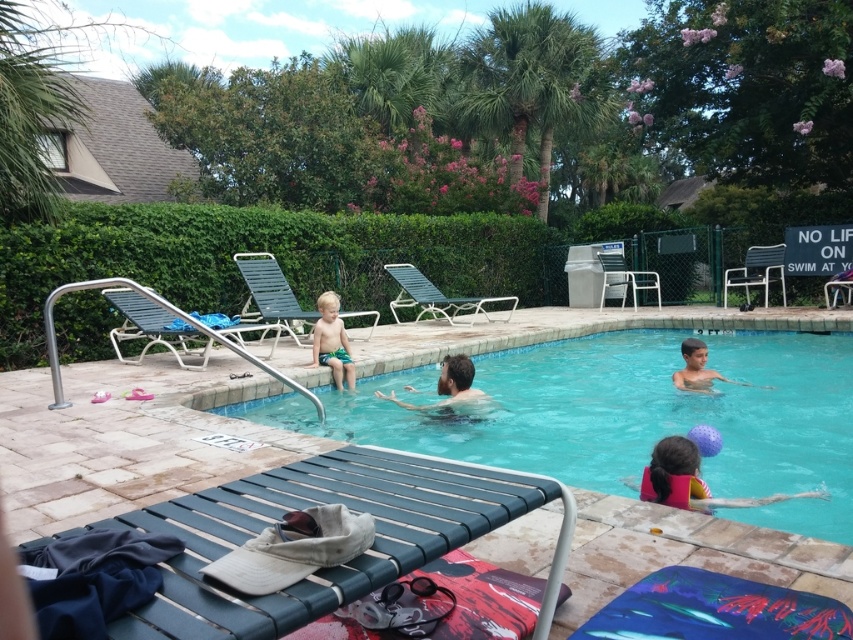
You are standing at the center of the pool deck and want to place a new lounge chair exactly at the point marked as point (689, 481). What object will this new lounge chair be placed near?

The new lounge chair will be placed near the pink life vest at lower right because point (689, 481) corresponds to that object.

You are planning to pack for a day at the pool. You have a backpack that can only fit one item. The pink life vest at lower right and the green fabric shorts at center are both in your sight. Which item should you take if you need to carry the larger one?

The pink life vest at lower right is bigger than the green fabric shorts at center, so you should take the pink life vest at lower right.

From the picture: You are standing at the center of the pool deck and want to retrieve the pink life vest at lower right. Based on the coordinates provided, in which direction should you move to reach it?

Result: The pink life vest at lower right is located at point 0.752 on the x and 0.810 on the y axis. Since you are at the center, you should move towards the lower right direction to reach it.